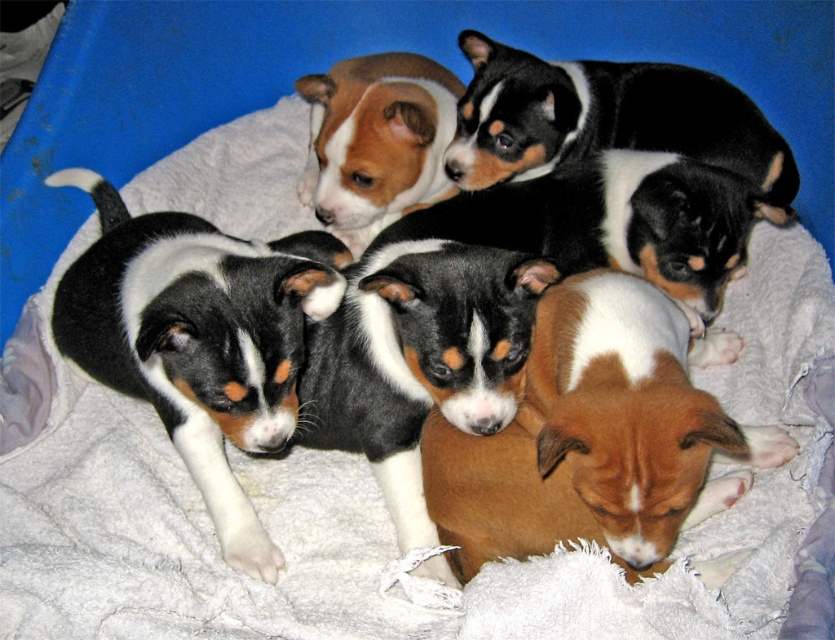
You are a dog breeder who needs to separate the puppies based on their fur color. You have a divider that is 20 inches long. If you place the divider between the brown fur at center and the black and white fur at upper center, will it reach both ends without overlapping?

The distance between the brown fur at center and the black and white fur at upper center is 20.75 inches. Since the divider is only 20 inches long, it will not be long enough to span the entire distance between them without overlapping.